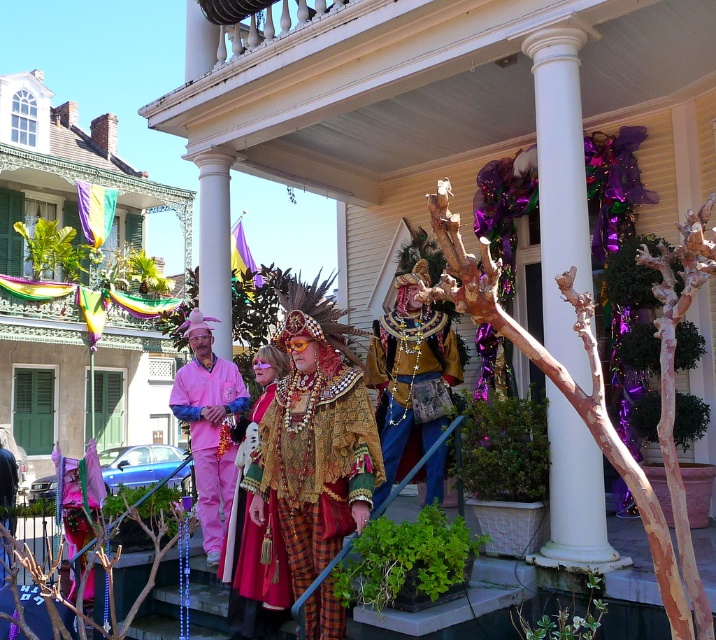
Question: Among these points, which one is nearest to the camera?

Choices:
 (A) (442, 472)
 (B) (205, 474)

Answer: (A)

Question: Is the position of gold sequined vest at center more distant than that of matte pink costume at center?

Choices:
 (A) no
 (B) yes

Answer: (B)

Question: Which object appears farthest from the camera in this image?

Choices:
 (A) matte pink costume at center
 (B) gold sequined vest at center
 (C) pink satin shirt at center

Answer: (C)

Question: Among these points, which one is nearest to the camera?

Choices:
 (A) (299, 467)
 (B) (400, 321)
 (C) (205, 396)
 (D) (223, 557)

Answer: (A)

Question: Is gold sequined vest at center further to camera compared to matte pink costume at center?

Choices:
 (A) yes
 (B) no

Answer: (A)

Question: Is gold sequined costume at center wider than gold sequined vest at center?

Choices:
 (A) no
 (B) yes

Answer: (B)